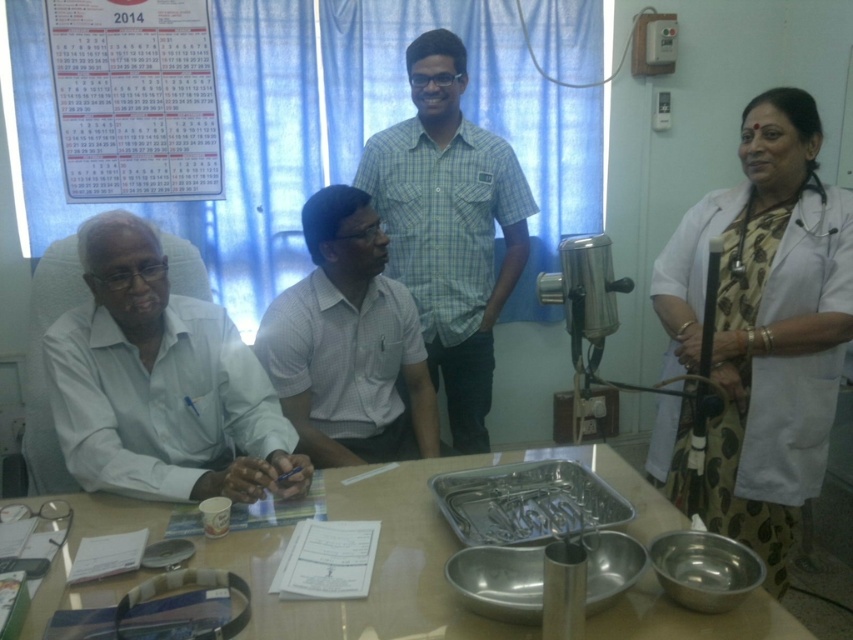
You are a patient entering the room and need to speak to the healthcare professional. Which person should you approach first, the one wearing the white coat at right or the white matte shirt at left?

You should approach the white coat at right first because the white matte shirt at left is behind the white coat at right, making the white coat at right more accessible.

Please provide the coordinates of the white matte shirt at left in the image. The coordinates should be in the format of a point with two decimal places separated by a comma, like 0.500,0.500. The origin is the top left corner of the image.

A: The coordinates of the white matte shirt at left are at point (160, 384).

You are a healthcare professional entering the room and need to quickly identify which individual has a wider shirt between the white matte shirt at left and the green checkered shirt at center. Which one should you point to?

The white matte shirt at left has a larger width than the green checkered shirt at center, so you should point to the white matte shirt at left.